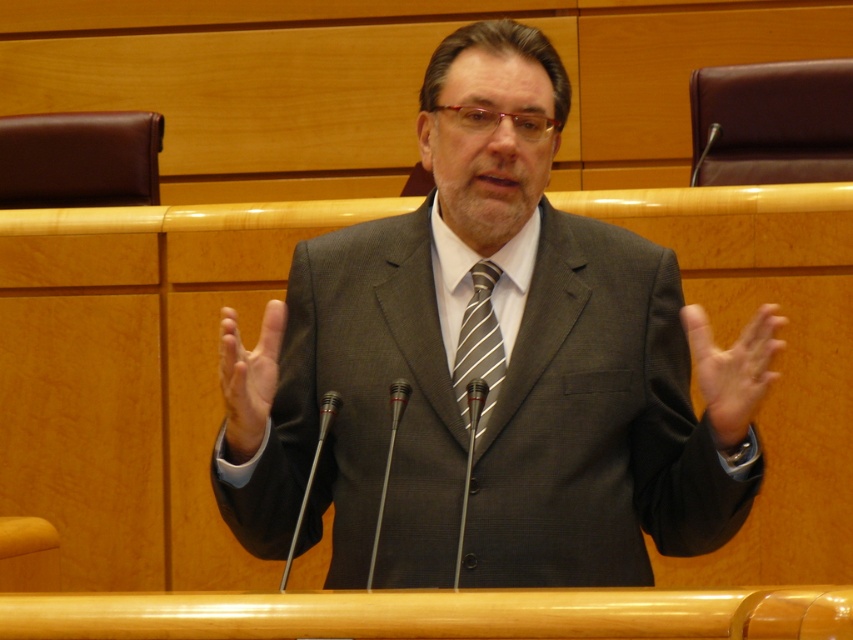
Question: Does matte gray suit at center appear under smooth skin hand at center?

Choices:
 (A) no
 (B) yes

Answer: (A)

Question: Is smooth skin hand at center thinner than striped silk tie at center?

Choices:
 (A) yes
 (B) no

Answer: (B)

Question: Among these objects, which one is farthest from the camera?

Choices:
 (A) matte gray suit at center
 (B) smooth skin hand at center

Answer: (A)

Question: Among these points, which one is farthest from the camera?

Choices:
 (A) (722, 390)
 (B) (596, 362)

Answer: (B)

Question: Which point is farther to the camera?

Choices:
 (A) smooth skin hand at center
 (B) striped silk tie at center
 (C) matte gray suit at center
 (D) matte gray hand at center

Answer: (B)

Question: Can you confirm if smooth skin hand at center is positioned to the right of striped silk tie at center?

Choices:
 (A) yes
 (B) no

Answer: (A)